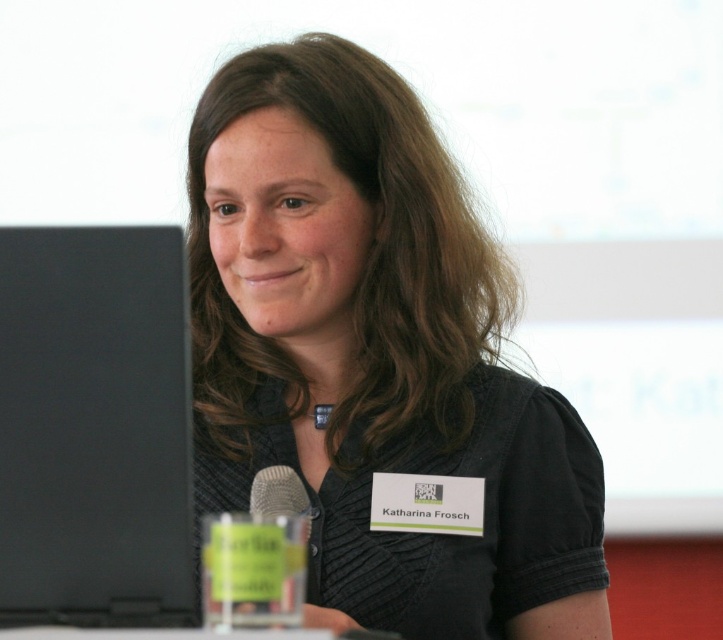
You are standing in a conference room and see the image. The conference room has a coordinate system where the bottom left corner is the origin point. Where is the black matte shirt at center located in terms of coordinates?

The black matte shirt at center is located at coordinates approximately 0.555 on the x axis and 0.519 on the y axis.

You are a photographer adjusting your camera to capture the presentation scene. You notice two points in the frame at coordinates point (56, 381) and point (291, 483). Which point should you focus on to ensure the closer one is sharp?

Point (56, 381) is closer to the camera than point (291, 483), so you should focus on point (56, 381) to ensure the closer one is sharp.